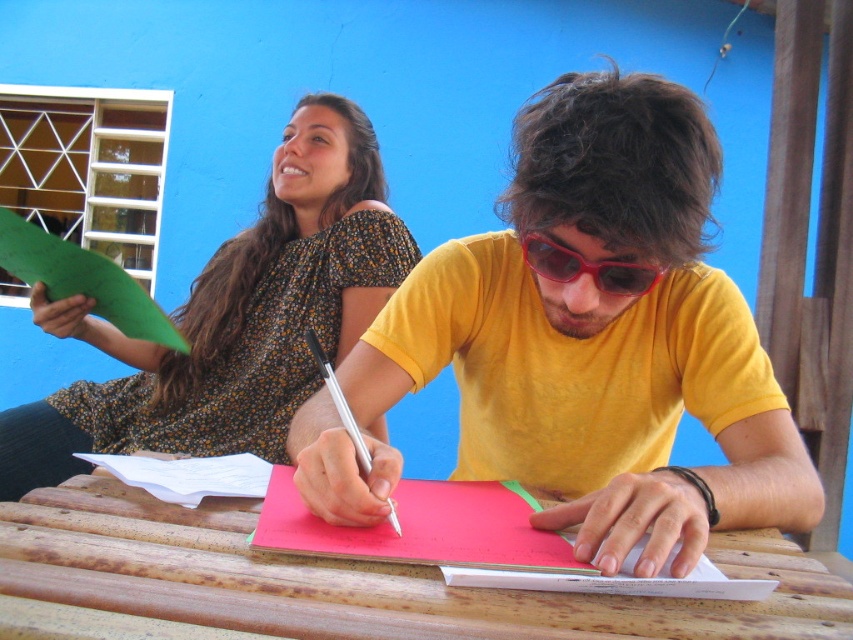
You are a photographer standing at the back of the scene. You want to take a photo of the wooden at center and the red plastic sunglasses at center. Which object will appear larger in your photo?

The wooden at center will appear larger in the photo because it is closer to the viewer than the red plastic sunglasses at center.

You are a photographer trying to capture the yellow matte shirt at center and the metallic silver pen at center in a single frame. Based on their positions, which object is closer to the right edge of the photo?

The yellow matte shirt at center is to the right of the metallic silver pen at center, so it is closer to the right edge of the photo.